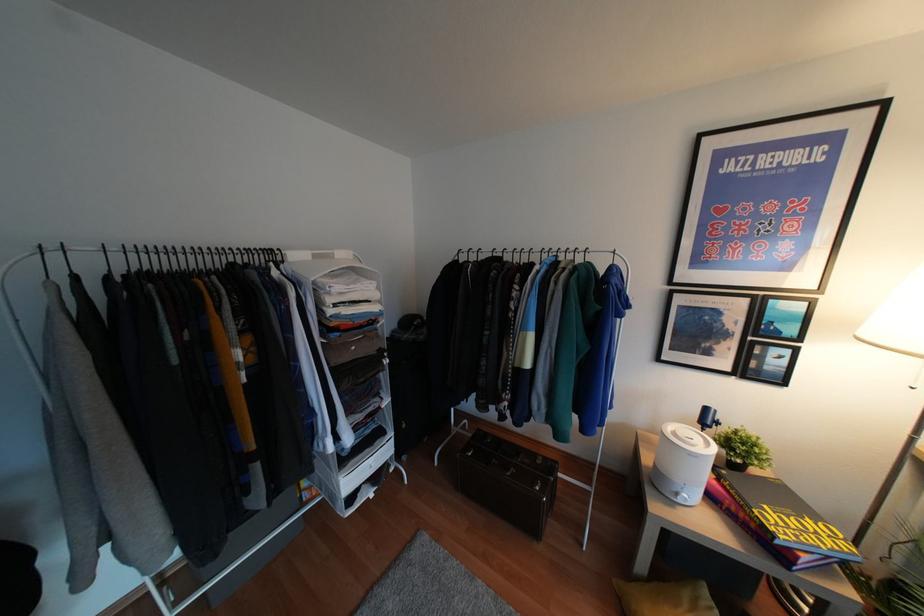
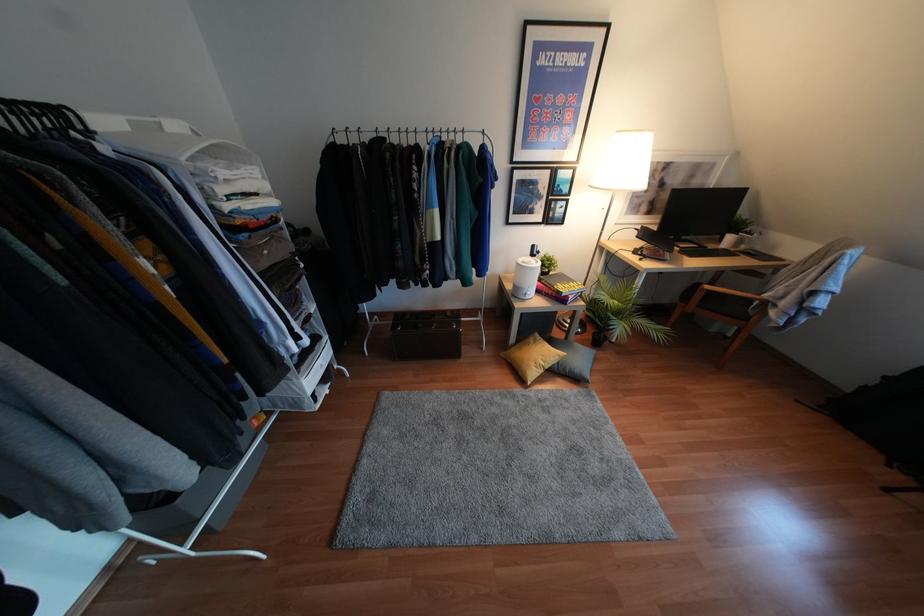
The point at (678,500) is marked in the first image. Where is the corresponding point in the second image?

(526, 297)